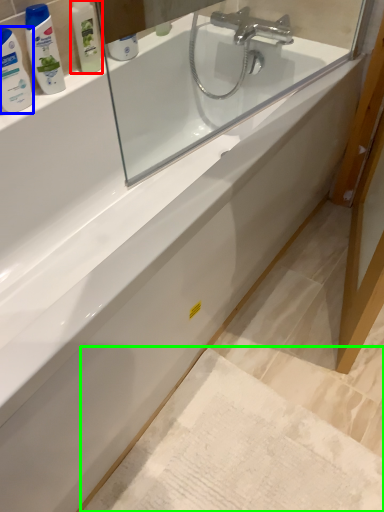
Question: Based on their relative distances, which object is nearer to toiletry (highlighted by a red box)? Choose from cleaning product (highlighted by a blue box) and bath mat (highlighted by a green box).

Choices:
 (A) cleaning product
 (B) bath mat

Answer: (A)